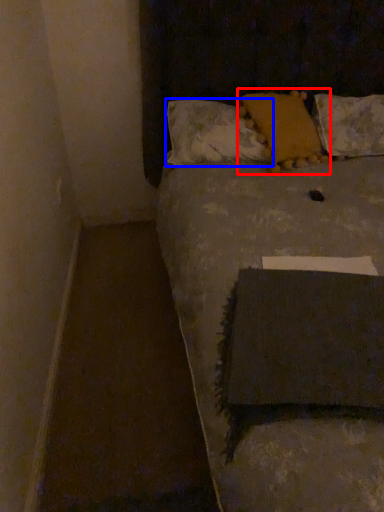
Question: Which point is further to the camera, pillow (highlighted by a red box) or pillow (highlighted by a blue box)?

Choices:
 (A) pillow
 (B) pillow

Answer: (B)